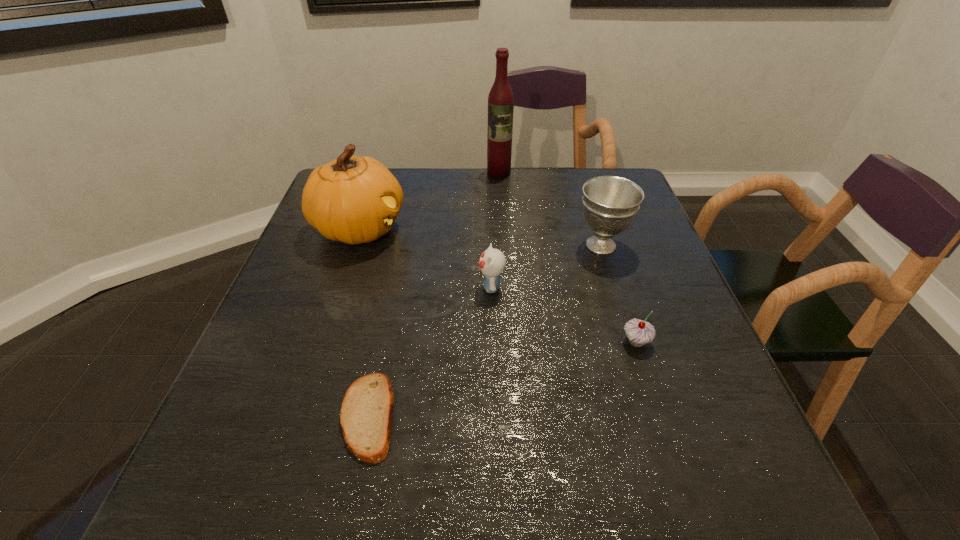
The height and width of the screenshot is (540, 960). I want to click on vacant area between the fifth tallest object and the nearest object, so click(502, 379).

In order to click on vacant area that lies between the third shortest object and the farthest object in this screenshot , I will do `click(495, 230)`.

The width and height of the screenshot is (960, 540). Find the location of `empty space between the shortest object and the chalice`. empty space between the shortest object and the chalice is located at coordinates (484, 330).

Where is `vacant space that's between the third nearest object and the tallest object`? This screenshot has height=540, width=960. vacant space that's between the third nearest object and the tallest object is located at coordinates (495, 230).

You are a GUI agent. You are given a task and a screenshot of the screen. Output one action in this format:
    pyautogui.click(x=<x>, y=<y>)
    Task: Click on the unoccupied position between the chalice and the second shortest object
    
    Given the screenshot: What is the action you would take?
    pyautogui.click(x=618, y=293)

The width and height of the screenshot is (960, 540). I want to click on free space that is in between the fourth shortest object and the third nearest object, so click(546, 266).

Identify the location of free spot between the shortest object and the farthest object. (433, 294).

Identify which object is located as the second nearest to the second tallest object. Please provide its 2D coordinates. Your answer should be formatted as a tuple, i.e. [(x, y)], where the tuple contains the x and y coordinates of a point satisfying the conditions above.

[(500, 99)]

Identify the location of object that is the fourth closest to the cupcake. (354, 199).

The width and height of the screenshot is (960, 540). I want to click on free space that satisfies the following two spatial constraints: 1. on the front-facing side of the fifth tallest object; 2. on the right side of the kitten, so click(x=492, y=342).